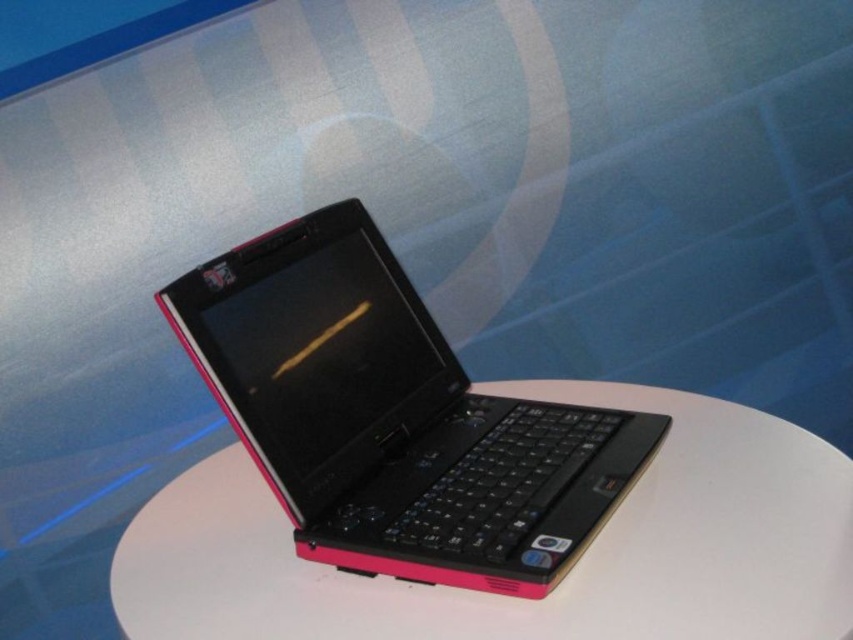
You are setting up a small desk area and need to ensure that the pink plastic laptop at center can fit on the white matte round table at center. Based on their sizes, will the laptop fit on the table?

The pink plastic laptop at center is taller than the white matte round table at center, so it cannot fit on the table since it exceeds the table height.

You are an interior designer planning to place a new lamp in the scene. The lamp must be positioned exactly 0.1 units to the right and 0.05 units above the pink plastic laptop at center. What are the coordinates of the lamp?

The coordinates of the lamp would be calculated by adding 0.1 to the x and 0.05 to the y of the pink plastic laptop at center. Since the laptop is at point (393, 417), the lamp would be at (436, 481).

You are standing in front of the laptop on the white circular table. There is a point marked at coordinates (393, 417). What object is located at that point?

The pink plastic laptop at center is located at point (393, 417).